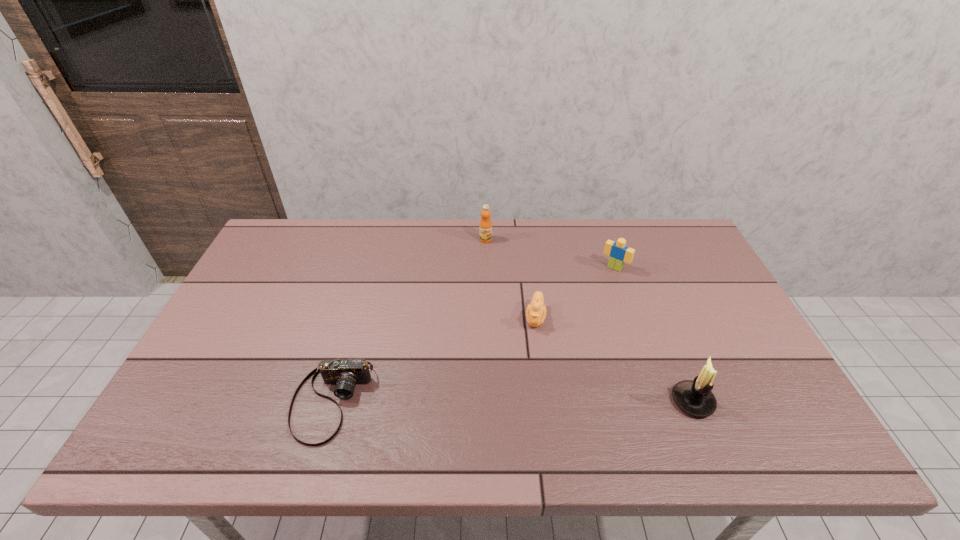
This screenshot has height=540, width=960. In order to click on Lego present at the far edge in this screenshot , I will do `click(619, 253)`.

The image size is (960, 540). What are the coordinates of `camera that is positioned at the near edge` in the screenshot? It's located at (345, 374).

Where is `candle holder positioned at the near edge`? candle holder positioned at the near edge is located at coordinates (694, 397).

The width and height of the screenshot is (960, 540). Identify the location of blank space at the far edge of the desktop. (386, 234).

The width and height of the screenshot is (960, 540). I want to click on blank space at the left edge of the desktop, so click(x=228, y=376).

In the image, there is a desktop. Identify the location of vacant space at the right edge. This screenshot has width=960, height=540. (700, 334).

Where is `vacant area at the far right corner of the desktop`? vacant area at the far right corner of the desktop is located at coordinates (677, 244).

Find the location of `free space at the near right corner of the desktop`. free space at the near right corner of the desktop is located at coordinates (756, 415).

The image size is (960, 540). Find the location of `vacant space that is in between the third object from right to left and the orange juice`. vacant space that is in between the third object from right to left and the orange juice is located at coordinates (511, 278).

What are the coordinates of `empty space between the farthest object and the duckling` in the screenshot? It's located at (511, 278).